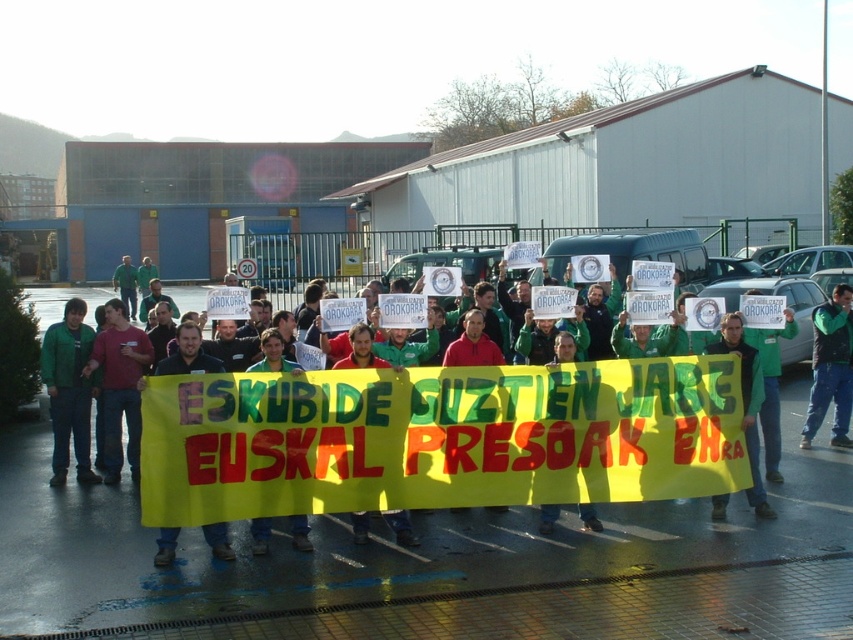
Is green fabric sign at center to the right of green fabric banner at center from the viewer's perspective?

Yes, green fabric sign at center is to the right of green fabric banner at center.

In the scene shown: Is green fabric sign at center to the left of green fabric banner at center from the viewer's perspective?

In fact, green fabric sign at center is to the right of green fabric banner at center.

Is point (757, 364) more distant than point (160, 369)?

That is True.

The image size is (853, 640). Identify the location of green fabric sign at center. (746, 400).

Looking at this image, which of these two, yellow fabric banner at center or green matte jacket at left, stands shorter?

With less height is yellow fabric banner at center.

Is yellow fabric banner at center further to the viewer compared to green matte jacket at left?

No.

This screenshot has height=640, width=853. Find the location of `yellow fabric banner at center`. yellow fabric banner at center is located at coordinates (438, 436).

Is dark red shirt at center above green fleece jacket at center?

No.

Does dark red shirt at center appear on the left side of green fleece jacket at center?

Indeed, dark red shirt at center is positioned on the left side of green fleece jacket at center.

Between point (108, 381) and point (828, 348), which one is positioned behind?

Point (828, 348)

What are the coordinates of `dark red shirt at center` in the screenshot? It's located at (119, 387).